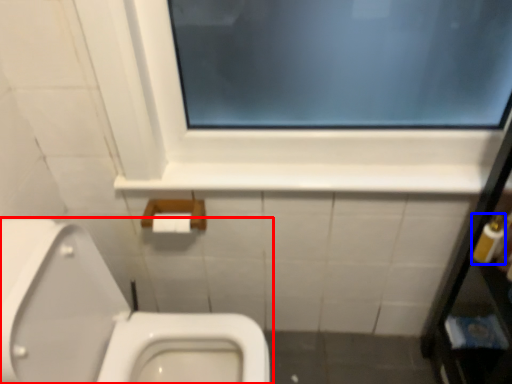
Question: Which object appears closest to the camera in this image, toilet (highlighted by a red box) or toiletry (highlighted by a blue box)?

Choices:
 (A) toilet
 (B) toiletry

Answer: (A)